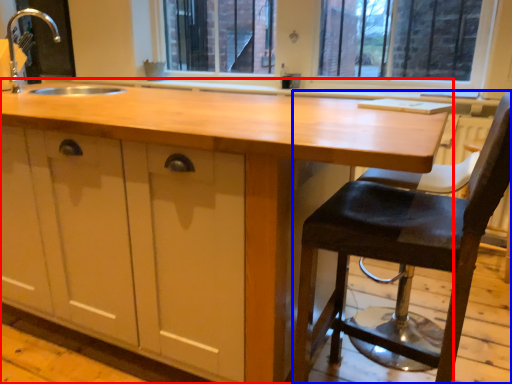
Question: Which point is closer to the camera, countertop (highlighted by a red box) or chair (highlighted by a blue box)?

Choices:
 (A) countertop
 (B) chair

Answer: (B)